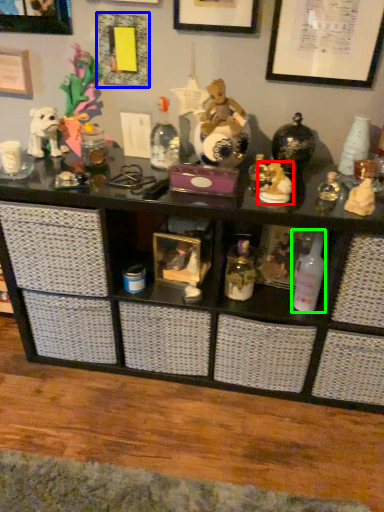
Question: Which object is positioned closest to toy (highlighted by a red box)? Select from picture frame (highlighted by a blue box) and bottle (highlighted by a green box).

Choices:
 (A) picture frame
 (B) bottle

Answer: (B)